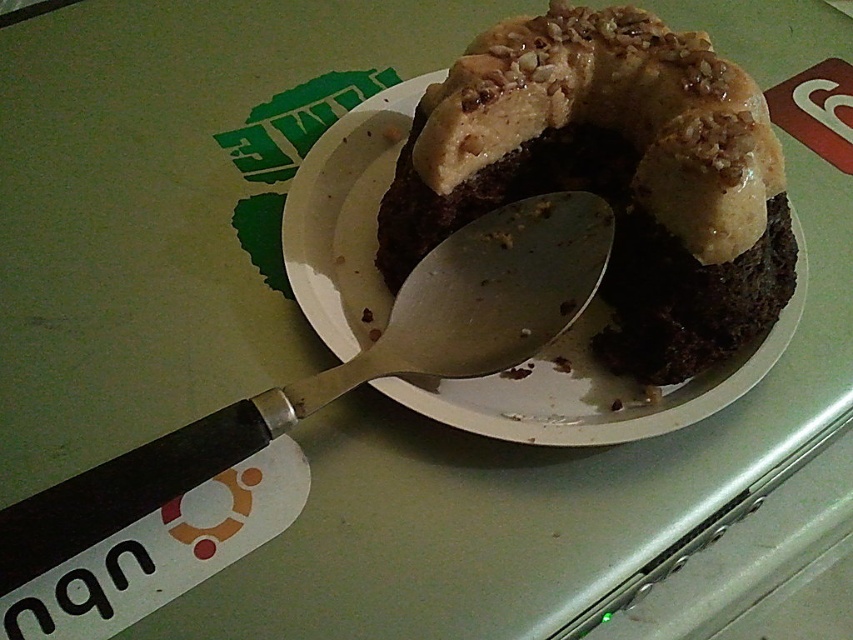
Can you confirm if chocolatesmoothcake at center is shorter than black plastic spoon at upper left?

In fact, chocolatesmoothcake at center may be taller than black plastic spoon at upper left.

Based on the photo, who is more forward, [711,161] or [146,464]?

Positioned in front is point [146,464].

Is point (392, 182) in front of point (231, 438)?

No, it is behind (231, 438).

Find the location of a particular element. chocolatesmoothcake at center is located at coordinates (611, 173).